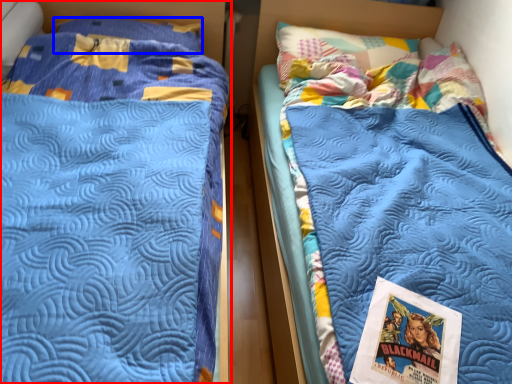
Question: Which object is closer to the camera taking this photo, bed (highlighted by a red box) or pillow (highlighted by a blue box)?

Choices:
 (A) bed
 (B) pillow

Answer: (A)